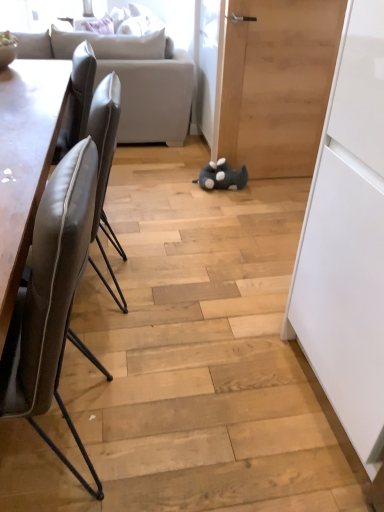
Question: Does leather at left, which is counted as the second chair, starting from the back, contain light gray fabric couch at upper left?

Choices:
 (A) yes
 (B) no

Answer: (B)

Question: Is leather at left, the 1th chair viewed from the front, not within light gray fabric couch at upper left?

Choices:
 (A) no
 (B) yes

Answer: (B)

Question: From a real-world perspective, does leather at left, which is counted as the second chair, starting from the back, sit lower than light gray fabric couch at upper left?

Choices:
 (A) yes
 (B) no

Answer: (A)

Question: Is leather at left, the 1th chair viewed from the front, shorter than light gray fabric couch at upper left?

Choices:
 (A) no
 (B) yes

Answer: (B)

Question: Is leather at left, which is counted as the second chair, starting from the back, facing towards light gray fabric couch at upper left?

Choices:
 (A) no
 (B) yes

Answer: (A)

Question: Is leather at left, which is counted as the second chair, starting from the back, further to the viewer compared to light gray fabric couch at upper left?

Choices:
 (A) no
 (B) yes

Answer: (A)

Question: Is gray plush toy at center positioned before leather at left, which is counted as the second chair, starting from the back?

Choices:
 (A) no
 (B) yes

Answer: (A)

Question: Can you confirm if gray plush toy at center is positioned to the right of leather at left, which is counted as the second chair, starting from the back?

Choices:
 (A) yes
 (B) no

Answer: (A)

Question: Can you confirm if gray plush toy at center is shorter than leather at left, the 1th chair viewed from the front?

Choices:
 (A) yes
 (B) no

Answer: (A)

Question: From the image's perspective, is gray plush toy at center on top of leather at left, which is counted as the second chair, starting from the back?

Choices:
 (A) yes
 (B) no

Answer: (A)

Question: Is gray plush toy at center not near leather at left, the 1th chair viewed from the front?

Choices:
 (A) yes
 (B) no

Answer: (A)

Question: Is gray plush toy at center oriented away from leather at left, which is counted as the second chair, starting from the back?

Choices:
 (A) no
 (B) yes

Answer: (A)

Question: Is leather at left, which appears as the first chair when viewed from the back, shorter than gray plush toy at center?

Choices:
 (A) yes
 (B) no

Answer: (B)